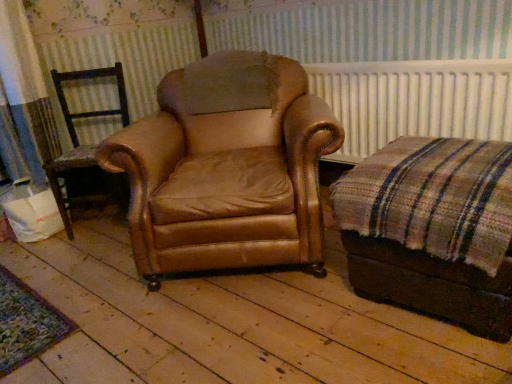
Question: Is brown leather chair at left, which appears as the 1th chair when viewed from the left, to the left or to the right of leather armchair at center, which is counted as the first chair, starting from the right, in the image?

Choices:
 (A) left
 (B) right

Answer: (A)

Question: Is brown leather chair at left, which is counted as the 2th chair, starting from the right, taller or shorter than leather armchair at center, placed as the 2th chair when sorted from left to right?

Choices:
 (A) short
 (B) tall

Answer: (A)

Question: Estimate the real-world distances between objects in this image. Which object is farther from the white radiator at upper center?

Choices:
 (A) leather armchair at center, placed as the 2th chair when sorted from left to right
 (B) plaid fabric ottoman at right
 (C) brown leather chair at left, which appears as the 1th chair when viewed from the left

Answer: (C)

Question: Estimate the real-world distances between objects in this image. Which object is closer to the plaid fabric ottoman at right?

Choices:
 (A) white radiator at upper center
 (B) brown leather chair at left, which is counted as the 2th chair, starting from the right
 (C) leather armchair at center, which is counted as the first chair, starting from the right

Answer: (C)